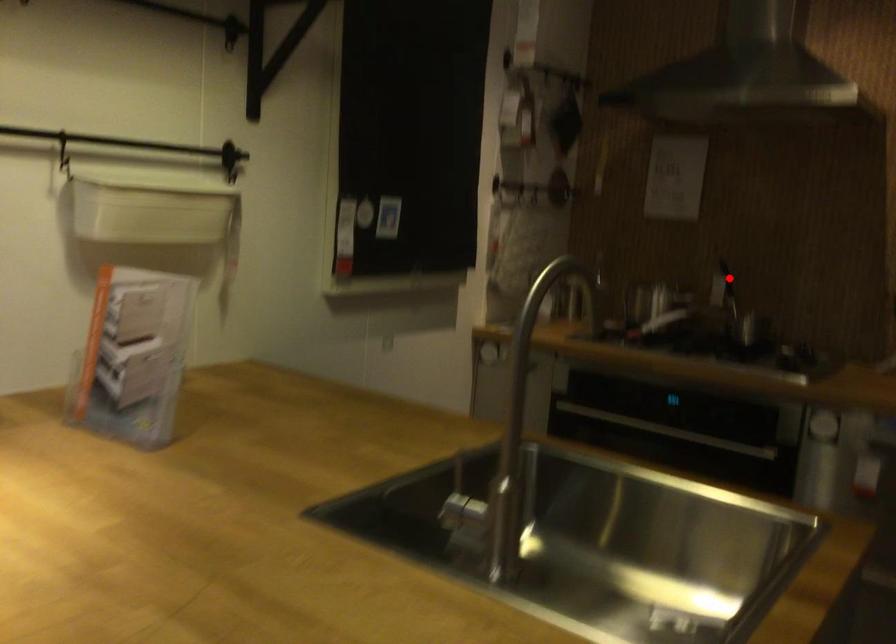
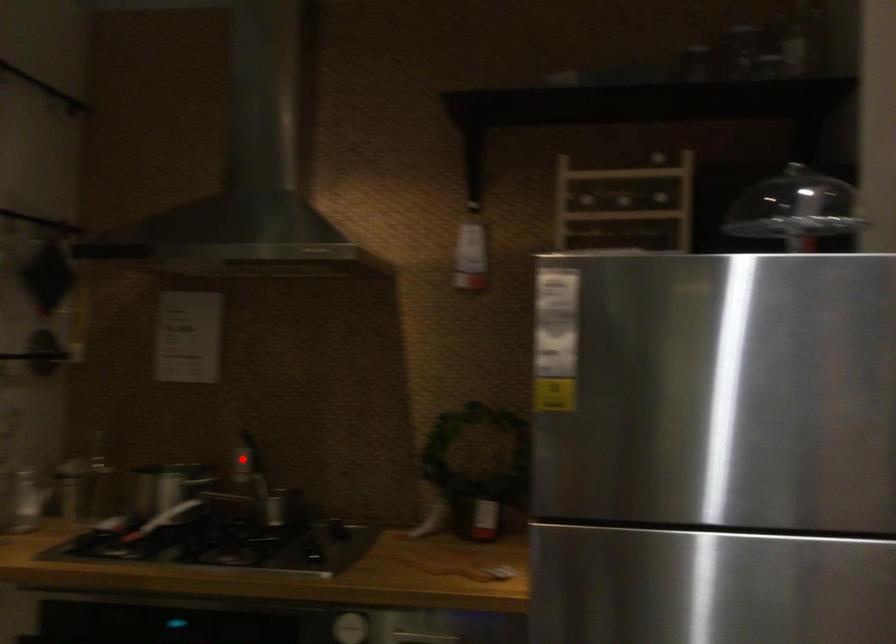
I am providing you with two images of the same scene from different viewpoints. A red point is marked on the first image and another point is marked on the second image. Does the point marked in image1 correspond to the same location as the one in image2?

Yes